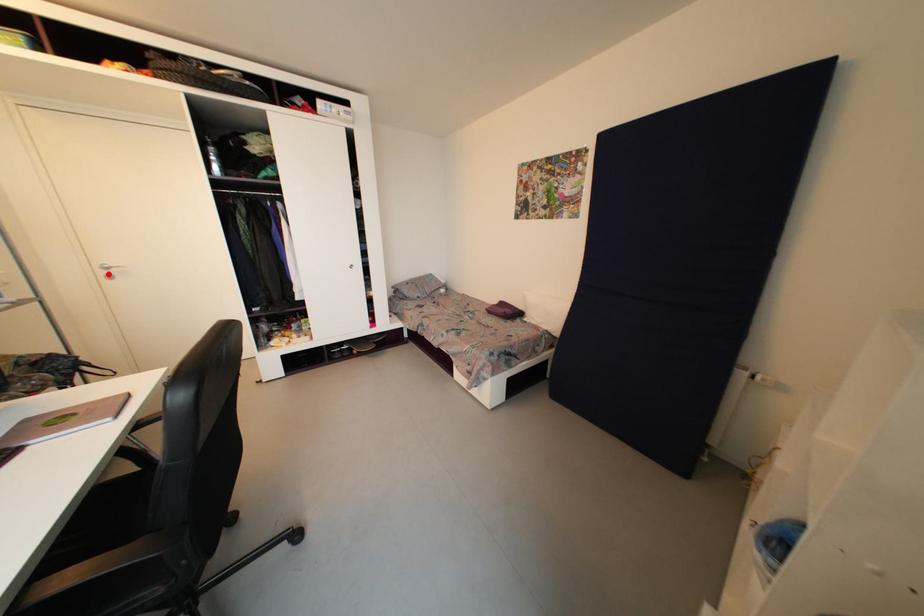
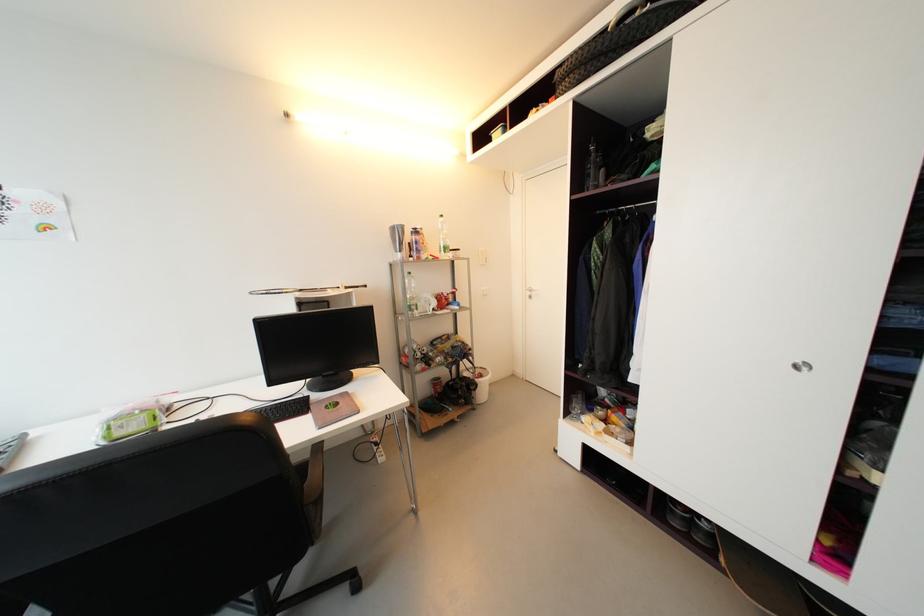
Question: I am providing you with two images of the same scene from different viewpoints. A red point is marked on the first image. At the location where the point appears in image 1, is it still visible in image 2?

Choices:
 (A) Yes
 (B) No

Answer: (A)